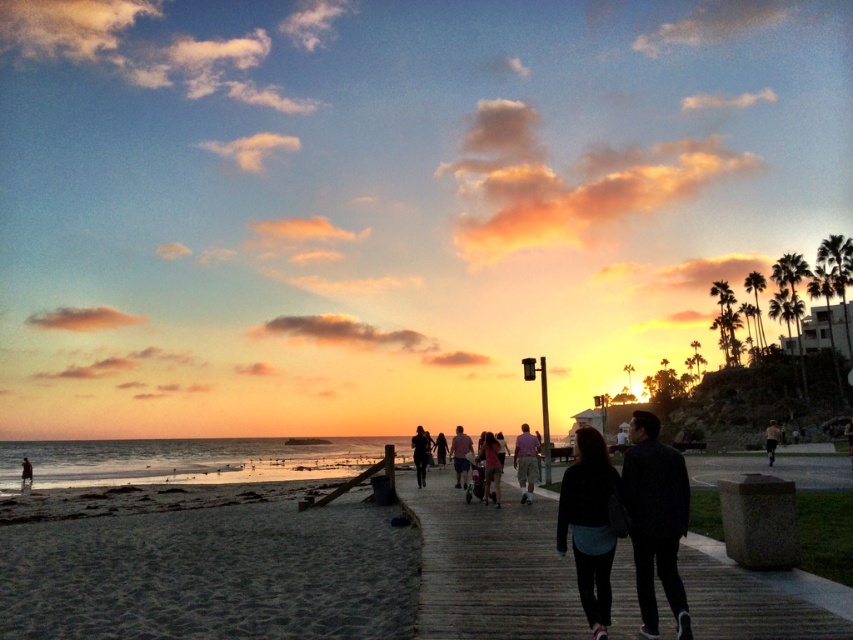
In the scene shown: Who is more forward, [579,506] or [482,456]?

Point [579,506] is in front.

Between dark blue jacket at center and matte pink shorts at center, which one appears on the left side from the viewer's perspective?

Positioned to the left is matte pink shorts at center.

Describe the element at coordinates (589, 524) in the screenshot. I see `dark blue jacket at center` at that location.

In order to click on dark blue jacket at center in this screenshot , I will do `click(589, 524)`.

Who is more forward, [453,438] or [524,472]?

Point [524,472]

Is light pink cotton shirt at center thinner than light pink shirt at center?

Incorrect, light pink cotton shirt at center's width is not less than light pink shirt at center's.

Identify the location of light pink cotton shirt at center. Image resolution: width=853 pixels, height=640 pixels. (479, 464).

Who is taller, pink cotton shirt at center or skinny jeans at center?

With more height is pink cotton shirt at center.

Is pink cotton shirt at center thinner than skinny jeans at center?

Correct, pink cotton shirt at center's width is less than skinny jeans at center's.

Identify the location of pink cotton shirt at center. This screenshot has height=640, width=853. (460, 456).

Where is `pink cotton shirt at center`? This screenshot has width=853, height=640. pink cotton shirt at center is located at coordinates [460, 456].